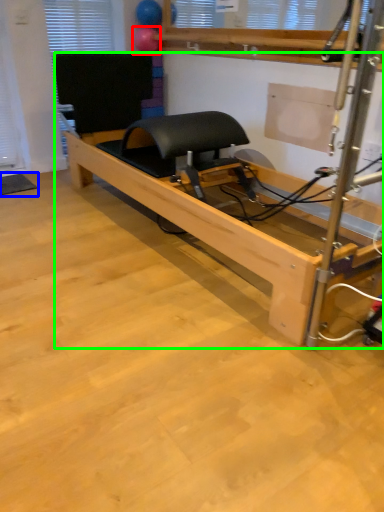
Question: Estimate the real-world distances between objects in this image. Which object is closer to balloon (highlighted by a red box), yoga mat (highlighted by a blue box) or furniture (highlighted by a green box)?

Choices:
 (A) yoga mat
 (B) furniture

Answer: (B)